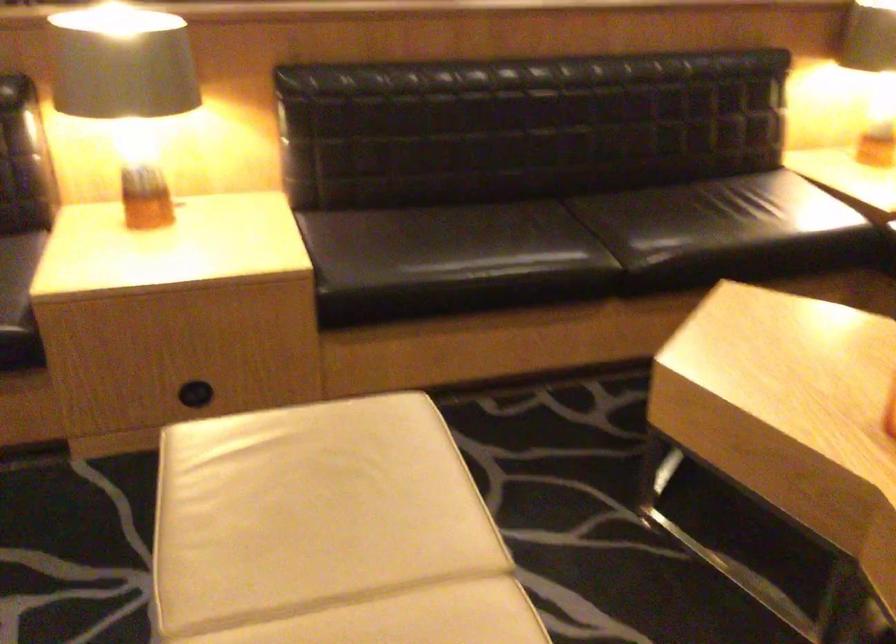
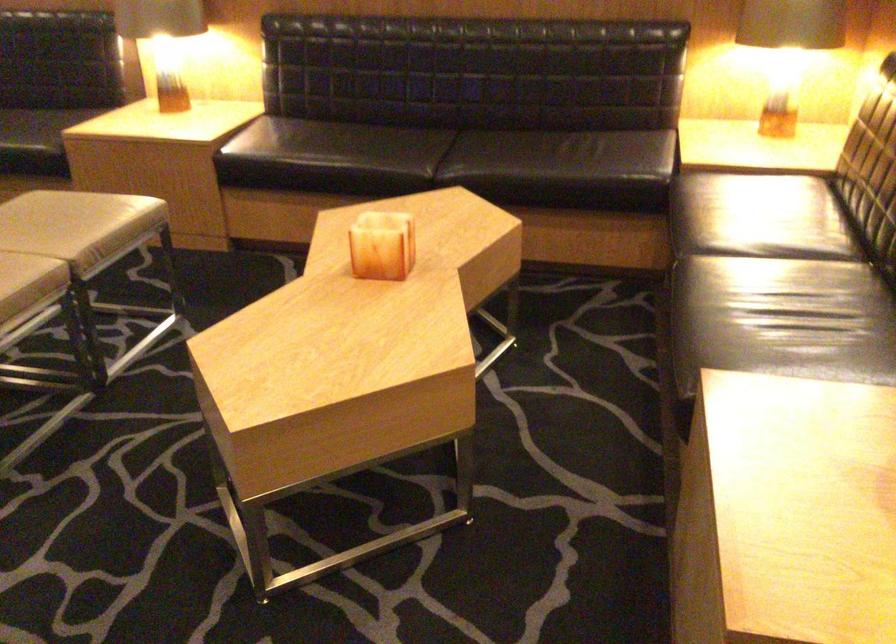
Locate, in the second image, the point that corresponds to (505,408) in the first image.

(283, 263)